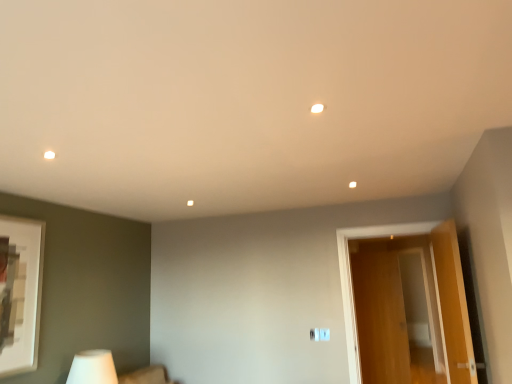
The width and height of the screenshot is (512, 384). Describe the element at coordinates (403, 303) in the screenshot. I see `wooden door at right` at that location.

You are a GUI agent. You are given a task and a screenshot of the screen. Output one action in this format:
    pyautogui.click(x=<x>, y=<y>)
    Task: Click on the wooden door at right
    This screenshot has width=512, height=384.
    Given the screenshot: What is the action you would take?
    pyautogui.click(x=403, y=303)

Measure the distance between wooden door at right and camera.

The depth of wooden door at right is 4.97 meters.

This screenshot has height=384, width=512. Describe the element at coordinates (93, 368) in the screenshot. I see `white matte table lamp at lower left` at that location.

At what (x,y) coordinates should I click in order to perform the action: click on white matte table lamp at lower left. Please return your answer as a coordinate pair (x, y). Looking at the image, I should click on (93, 368).

I want to click on wooden door at right, so click(403, 303).

Is wooden door at right to the left or to the right of white matte table lamp at lower left in the image?

Based on their positions, wooden door at right is located to the right of white matte table lamp at lower left.

Considering the relative positions of wooden door at right and white matte table lamp at lower left in the image provided, is wooden door at right in front of white matte table lamp at lower left?

No, wooden door at right is further to the viewer.

Is point (460, 315) positioned behind point (91, 382)?

Yes.

From the image's perspective, who appears lower, wooden door at right or white matte table lamp at lower left?

white matte table lamp at lower left appears lower in the image.

From a real-world perspective, is wooden door at right located higher than white matte table lamp at lower left?

Yes, from a real-world perspective, wooden door at right is over white matte table lamp at lower left

Which of these two, wooden door at right or white matte table lamp at lower left, is thinner?

wooden door at right.

From their relative heights in the image, would you say wooden door at right is taller or shorter than white matte table lamp at lower left?

Clearly, wooden door at right is taller compared to white matte table lamp at lower left.

Does wooden door at right have a larger size compared to white matte table lamp at lower left?

Correct, wooden door at right is larger in size than white matte table lamp at lower left.

Which is correct: wooden door at right is inside white matte table lamp at lower left, or outside of it?

wooden door at right is not enclosed by white matte table lamp at lower left.

Does wooden door at right touch white matte table lamp at lower left?

wooden door at right and white matte table lamp at lower left are clearly separated.

Is wooden door at right facing away from white matte table lamp at lower left?

wooden door at right is not turned away from white matte table lamp at lower left.

Can you tell me how much wooden door at right and white matte table lamp at lower left differ in facing direction?

91.3 degrees.

How distant is wooden door at right from white matte table lamp at lower left?

wooden door at right and white matte table lamp at lower left are 3.42 meters apart.

This screenshot has width=512, height=384. I want to click on table lamp below the wooden door at right (from a real-world perspective), so click(x=93, y=368).

Based on their positions, is white matte table lamp at lower left located to the left or right of wooden door at right?

In the image, white matte table lamp at lower left appears on the left side of wooden door at right.

Who is more distant, white matte table lamp at lower left or wooden door at right?

wooden door at right is behind.

Does point (100, 361) come farther from viewer compared to point (415, 230)?

No, it is in front of (415, 230).

From the image's perspective, is white matte table lamp at lower left under wooden door at right?

Correct, white matte table lamp at lower left appears lower than wooden door at right in the image.

Looking at this image, from a real-world perspective, is white matte table lamp at lower left positioned above or below wooden door at right?

white matte table lamp at lower left is situated lower than wooden door at right in the real world.

Is white matte table lamp at lower left wider than wooden door at right?

Indeed, white matte table lamp at lower left has a greater width compared to wooden door at right.

Considering the relative sizes of white matte table lamp at lower left and wooden door at right in the image provided, is white matte table lamp at lower left taller than wooden door at right?

No.

Considering the sizes of white matte table lamp at lower left and wooden door at right in the image, is white matte table lamp at lower left bigger or smaller than wooden door at right?

In the image, white matte table lamp at lower left appears to be smaller than wooden door at right.

Is wooden door at right surrounded by white matte table lamp at lower left?

No, wooden door at right is not surrounded by white matte table lamp at lower left.

Are white matte table lamp at lower left and wooden door at right located far from each other?

Yes, white matte table lamp at lower left and wooden door at right are located far from each other.

Is white matte table lamp at lower left looking in the opposite direction of wooden door at right?

white matte table lamp at lower left does not have its back to wooden door at right.

Can you tell me how much white matte table lamp at lower left and wooden door at right differ in facing direction?

The angular difference between white matte table lamp at lower left and wooden door at right is 91.3 degrees.

How far apart are white matte table lamp at lower left and wooden door at right?

white matte table lamp at lower left and wooden door at right are 3.42 meters apart from each other.

This screenshot has width=512, height=384. In order to click on door above the white matte table lamp at lower left (from a real-world perspective) in this screenshot , I will do `click(403, 303)`.

At what (x,y) coordinates should I click in order to perform the action: click on table lamp on the left of wooden door at right. Please return your answer as a coordinate pair (x, y). Looking at the image, I should click on (93, 368).

Where is `table lamp directly beneath the wooden door at right (from a real-world perspective)`? This screenshot has width=512, height=384. table lamp directly beneath the wooden door at right (from a real-world perspective) is located at coordinates (93, 368).